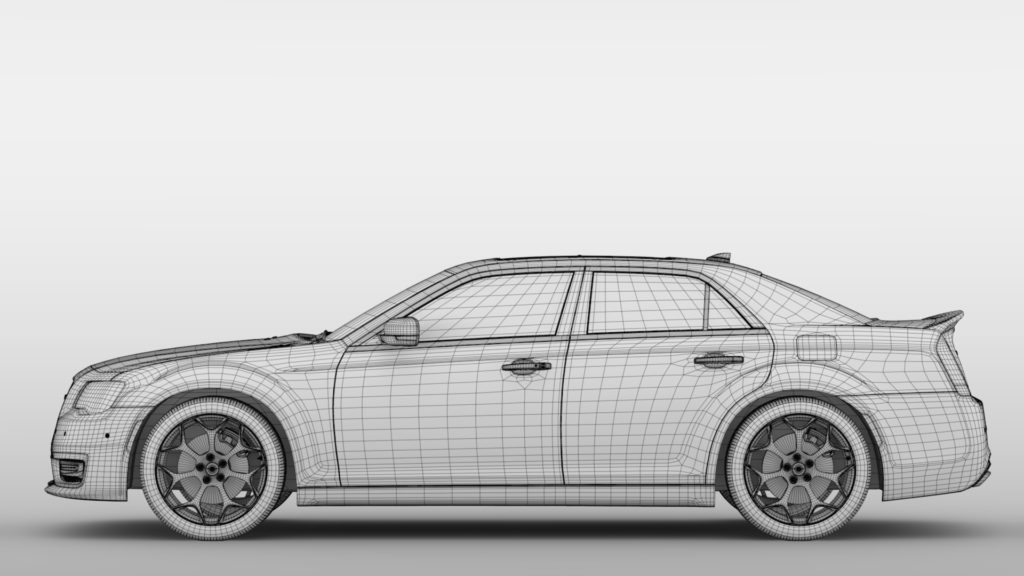
Locate an element on the screen. This screenshot has width=1024, height=576. door is located at coordinates (415, 442).